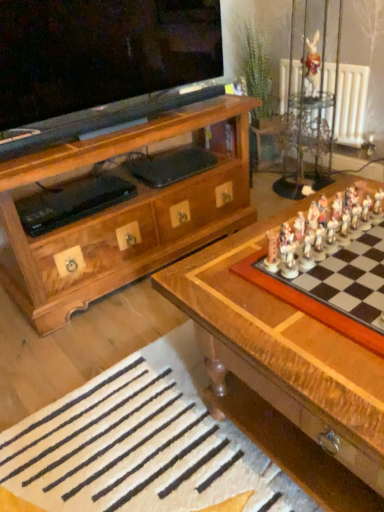
Locate an element on the screen. This screenshot has height=512, width=384. free point below wooden chessboard at right (from a real-world perspective) is located at coordinates (347, 276).